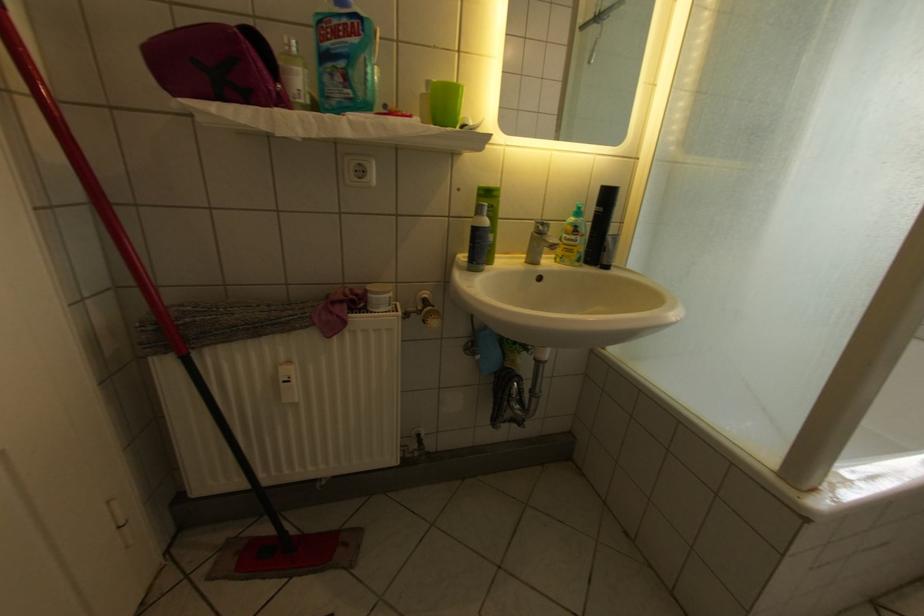
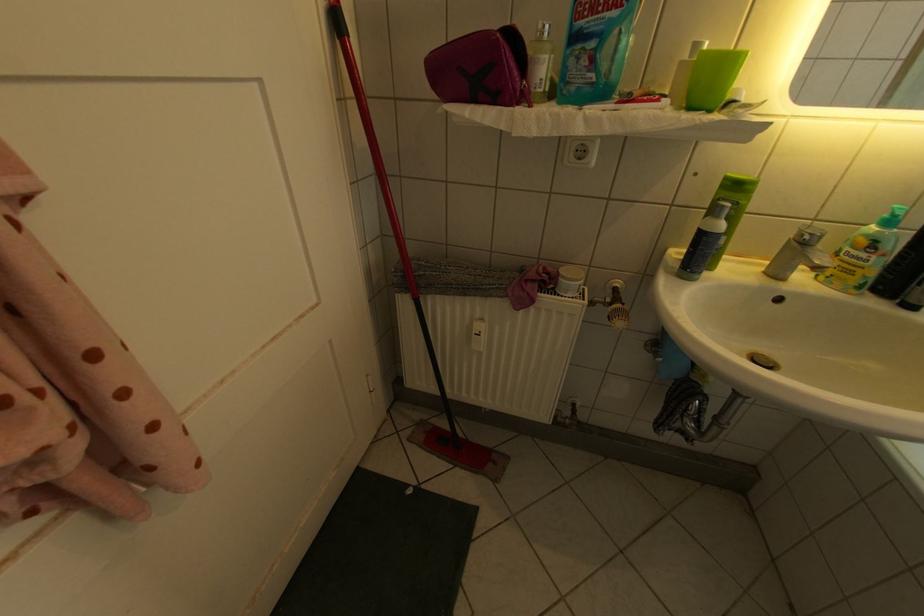
Locate, in the second image, the point that corresponds to pixel 590 238 in the first image.

(888, 257)